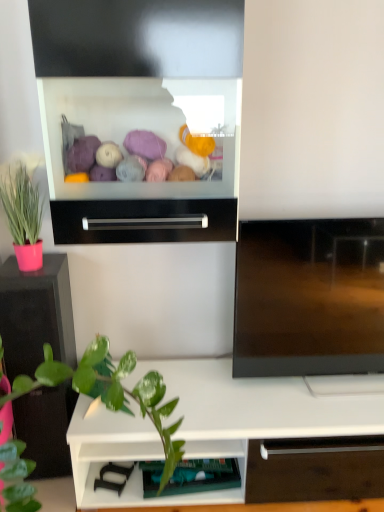
Question: From the image's perspective, is white matte shelf at lower center, the 1th shelf viewed from the right, above or below black glossy tv cabinet at left?

Choices:
 (A) below
 (B) above

Answer: (A)

Question: In terms of width, does white matte shelf at lower center, which appears as the second shelf when viewed from the left, look wider or thinner when compared to black glossy tv cabinet at left?

Choices:
 (A) wide
 (B) thin

Answer: (A)

Question: Which of these objects is positioned farthest from the teal fabric drawer at lower center, which is counted as the 1th shelf, starting from the left?

Choices:
 (A) pink matte pot at left
 (B) white matte shelf at lower center, the 1th shelf viewed from the right
 (C) black glossy tv cabinet at left
 (D) black metallic drawer at center

Answer: (A)

Question: Estimate the real-world distances between objects in this image. Which object is farther from the teal fabric drawer at lower center, which is counted as the 1th shelf, starting from the left?

Choices:
 (A) black metallic drawer at center
 (B) black glossy tv cabinet at left
 (C) white matte shelf at lower center, the 1th shelf viewed from the right
 (D) pink matte pot at left

Answer: (D)